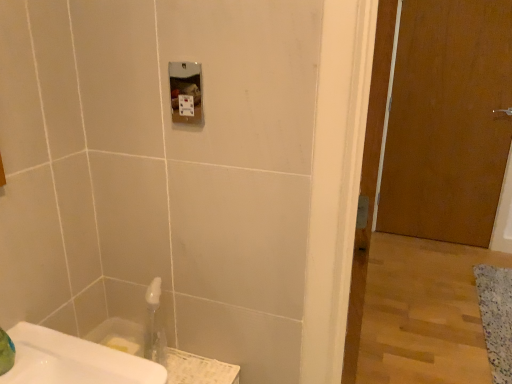
Question: Should I look upward or downward to see brown wooden door at right?

Choices:
 (A) up
 (B) down

Answer: (A)